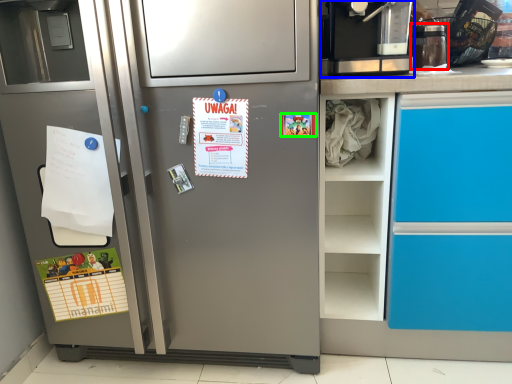
Question: Which is nearer to the appliance (highlighted by a red box)? coffee machine (highlighted by a blue box) or postcard (highlighted by a green box).

Choices:
 (A) coffee machine
 (B) postcard

Answer: (A)